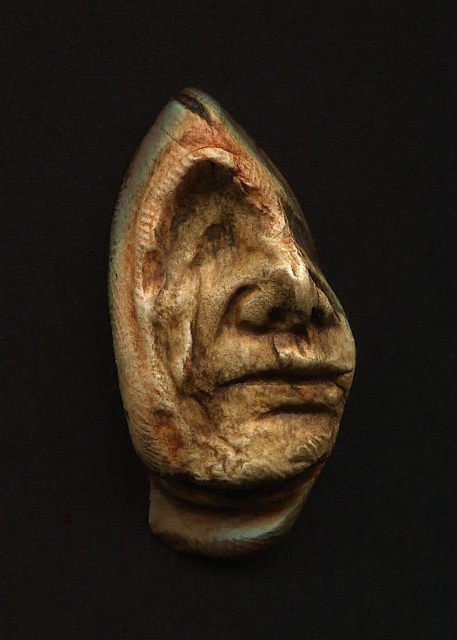
Can you confirm if rusty clay mask at center is shorter than earthy clay mask at center?

In fact, rusty clay mask at center may be taller than earthy clay mask at center.

Who is more forward, (x=229, y=317) or (x=234, y=273)?

Positioned in front is point (x=229, y=317).

Locate an element on the screen. Image resolution: width=457 pixels, height=640 pixels. rusty clay mask at center is located at coordinates (222, 333).